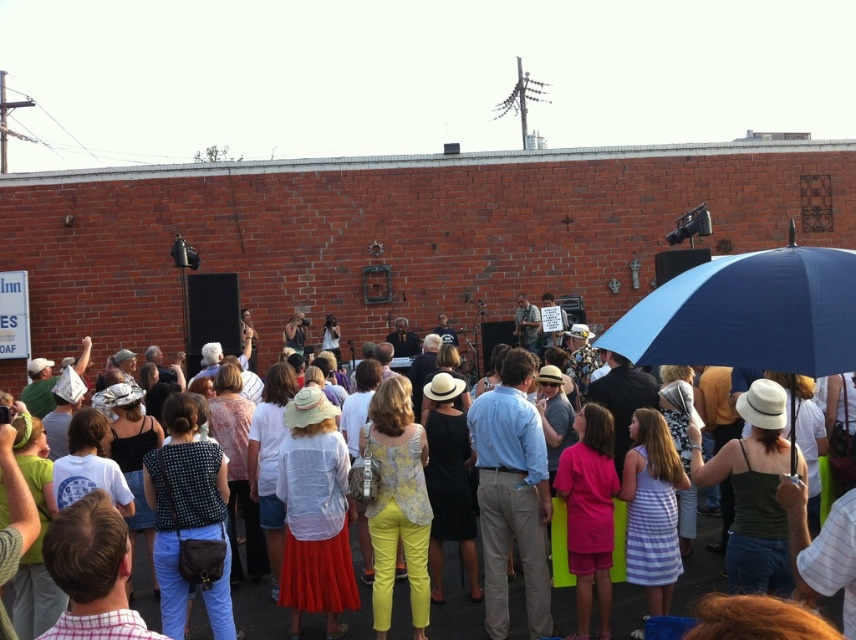
Question: Does blue matte umbrella at upper right appear on the left side of matte white shirt at center?

Choices:
 (A) no
 (B) yes

Answer: (A)

Question: From the image, what is the correct spatial relationship of blue matte umbrella at upper right in relation to matte white shirt at center?

Choices:
 (A) below
 (B) above

Answer: (B)

Question: Is blue matte umbrella at upper right thinner than matte white shirt at center?

Choices:
 (A) no
 (B) yes

Answer: (B)

Question: Among these points, which one is nearest to the camera?

Choices:
 (A) click(x=554, y=625)
 (B) click(x=767, y=296)

Answer: (B)

Question: Which of the following is the farthest from the observer?

Choices:
 (A) (649, 301)
 (B) (524, 634)

Answer: (B)